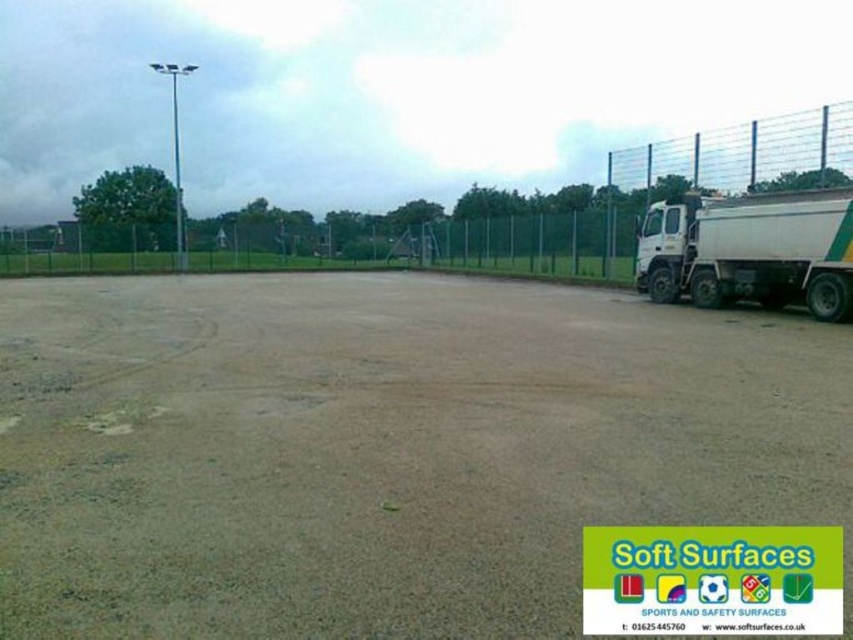
In the scene shown: You are a groundskeeper trying to access the brown gravel dirt field at center to perform maintenance. There is a metal mesh fence at upper right nearby. Can you walk directly to the field from your current position without going through any gates or barriers?

The brown gravel dirt field at center is below the metal mesh fence at upper right, so you can walk directly to the field from your current position without needing to go through gates or barriers since the fence is positioned above the field and not blocking the path.

You are standing at the edge of the sports field and see two points marked on the ground. The first point is at coordinate point(708, 337) and the second is at coordinate point(805, 164). Which point is closer to you?

Point(708, 337) is closer to the viewer than point(805, 164).